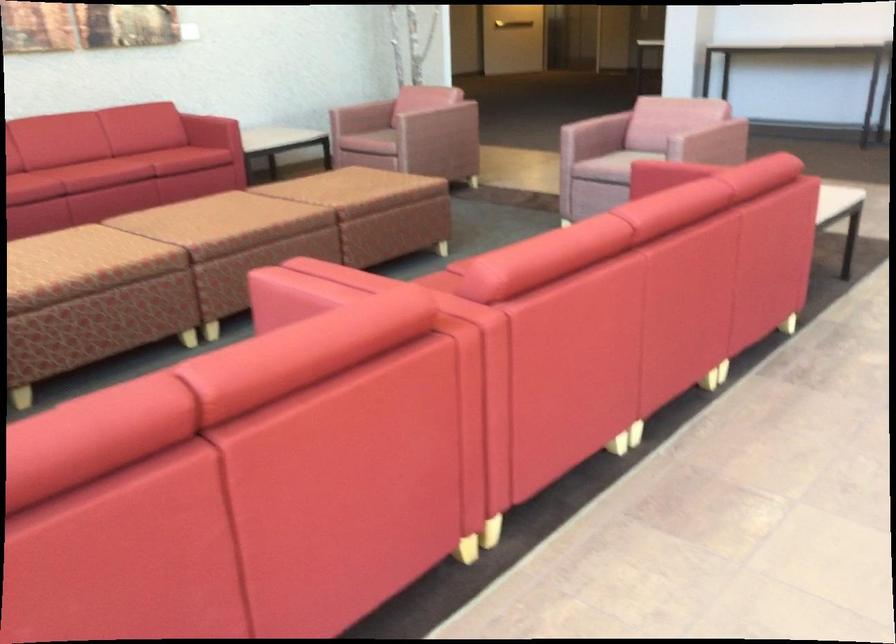
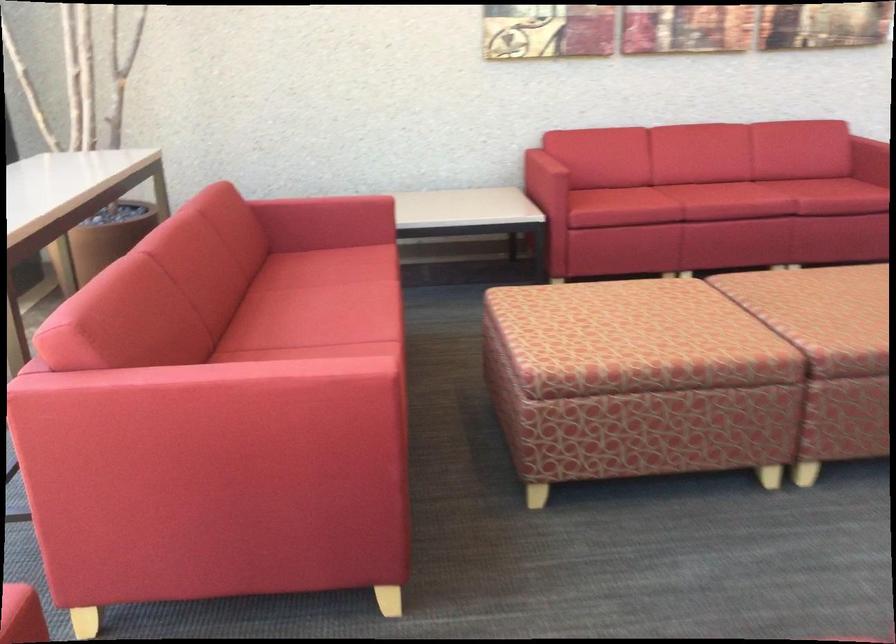
Locate, in the second image, the point that corresponds to [106,173] in the first image.

(725, 201)